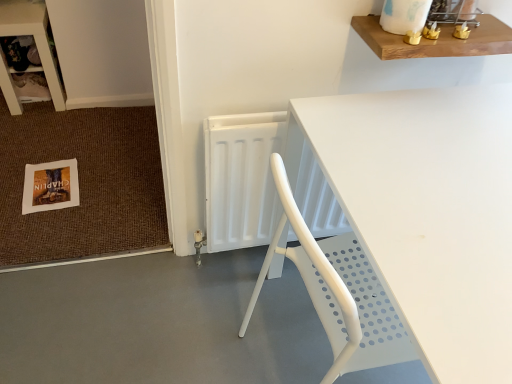
Question: Is white paper postcard at lower left a part of wooden shelf at upper right?

Choices:
 (A) no
 (B) yes

Answer: (A)

Question: Is wooden shelf at upper right shorter than white paper postcard at lower left?

Choices:
 (A) yes
 (B) no

Answer: (B)

Question: Considering the relative positions of wooden shelf at upper right and white paper postcard at lower left in the image provided, is wooden shelf at upper right behind white paper postcard at lower left?

Choices:
 (A) no
 (B) yes

Answer: (A)

Question: Considering the relative sizes of wooden shelf at upper right and white paper postcard at lower left in the image provided, is wooden shelf at upper right taller than white paper postcard at lower left?

Choices:
 (A) yes
 (B) no

Answer: (A)

Question: Can you confirm if wooden shelf at upper right is smaller than white paper postcard at lower left?

Choices:
 (A) yes
 (B) no

Answer: (B)

Question: Is white paper doormat at lower left taller or shorter than wooden shelf at upper left?

Choices:
 (A) tall
 (B) short

Answer: (B)

Question: From the image's perspective, relative to wooden shelf at upper left, is white paper doormat at lower left above or below?

Choices:
 (A) above
 (B) below

Answer: (B)

Question: In terms of size, does white paper doormat at lower left appear bigger or smaller than wooden shelf at upper left?

Choices:
 (A) small
 (B) big

Answer: (A)

Question: Relative to wooden shelf at upper left, is white paper doormat at lower left in front or behind?

Choices:
 (A) behind
 (B) front

Answer: (B)

Question: Is wooden shelf at upper left wider or thinner than white plastic radiator at center?

Choices:
 (A) thin
 (B) wide

Answer: (B)

Question: From a real-world perspective, relative to white plastic radiator at center, is wooden shelf at upper left vertically above or below?

Choices:
 (A) above
 (B) below

Answer: (B)

Question: Is wooden shelf at upper left bigger or smaller than white plastic radiator at center?

Choices:
 (A) small
 (B) big

Answer: (B)

Question: From the image's perspective, is wooden shelf at upper left above or below white plastic radiator at center?

Choices:
 (A) below
 (B) above

Answer: (B)

Question: From the image's perspective, is white paper doormat at lower left positioned above or below white paper postcard at lower left?

Choices:
 (A) below
 (B) above

Answer: (B)

Question: Is white paper doormat at lower left bigger or smaller than white paper postcard at lower left?

Choices:
 (A) big
 (B) small

Answer: (A)